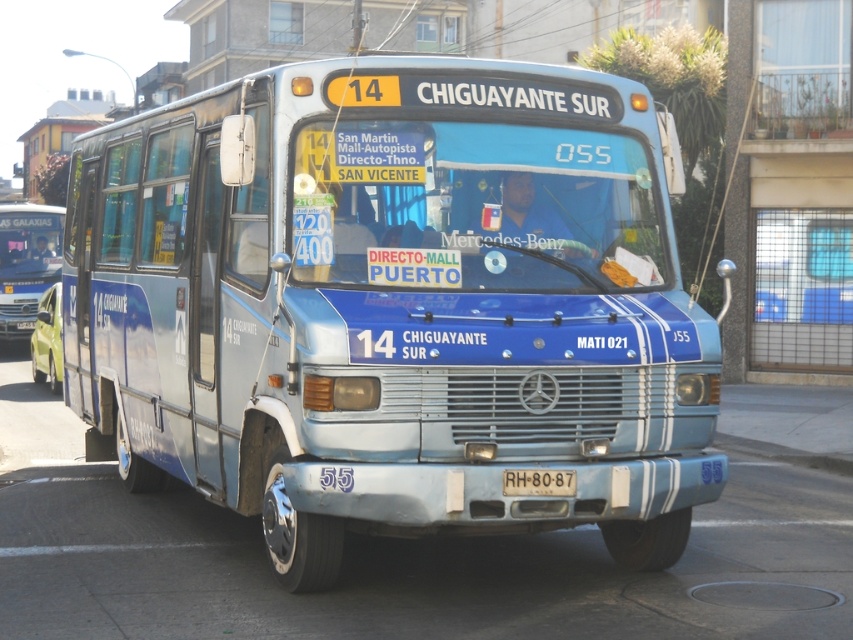
Question: Does blue metallic bus at center come in front of white plastic license plate at center?

Choices:
 (A) yes
 (B) no

Answer: (A)

Question: Which point appears closest to the camera in this image?

Choices:
 (A) (515, 472)
 (B) (231, 218)
 (C) (16, 250)

Answer: (A)

Question: Which object is the closest to the matte blue bus at left?

Choices:
 (A) white plastic license plate at center
 (B) blue metallic bus at center

Answer: (B)

Question: Is blue metallic bus at center to the left of white plastic license plate at center from the viewer's perspective?

Choices:
 (A) no
 (B) yes

Answer: (B)

Question: Is blue metallic bus at center positioned behind white plastic license plate at center?

Choices:
 (A) no
 (B) yes

Answer: (A)

Question: Estimate the real-world distances between objects in this image. Which object is farther from the blue metallic bus at center?

Choices:
 (A) white plastic license plate at center
 (B) matte blue bus at left

Answer: (B)